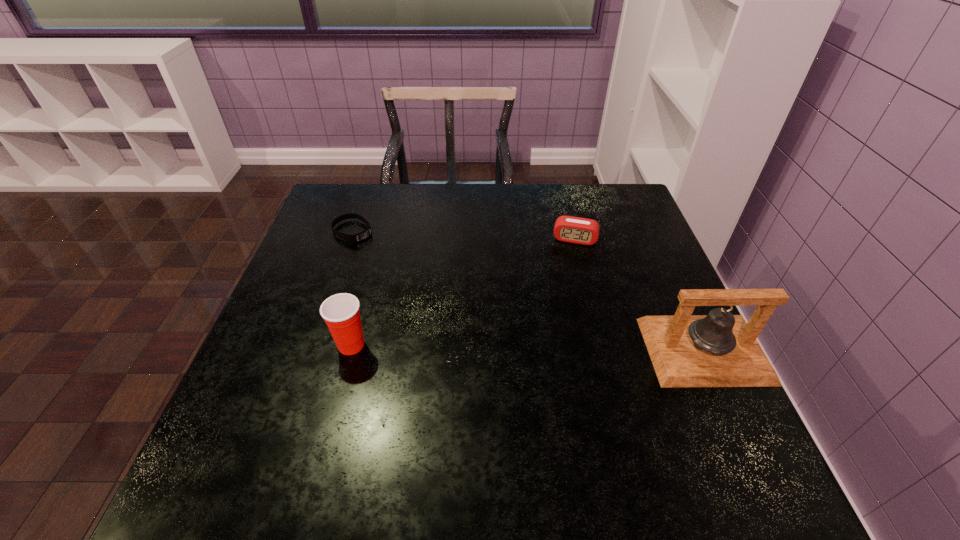
Find the location of a particular element. Image resolution: width=960 pixels, height=540 pixels. free point at the far edge is located at coordinates (425, 186).

Where is `free space at the near edge of the desktop`? The image size is (960, 540). free space at the near edge of the desktop is located at coordinates (635, 409).

You are a GUI agent. You are given a task and a screenshot of the screen. Output one action in this format:
    pyautogui.click(x=<x>, y=<y>)
    Task: Click on the free space at the left edge of the desktop
    
    Given the screenshot: What is the action you would take?
    pos(270,371)

In the image, there is a desktop. Identify the location of vacant area at the right edge. Image resolution: width=960 pixels, height=540 pixels. (641, 258).

Identify the location of vacant space at the far left corner of the desktop. (345, 187).

Find the location of `blank space at the near left corner of the desktop`. blank space at the near left corner of the desktop is located at coordinates (277, 399).

Identify the location of free space between the tallest object and the shortest object. (528, 291).

Where is `empty space that is in between the third object from left to right and the third shortest object`? Image resolution: width=960 pixels, height=540 pixels. empty space that is in between the third object from left to right and the third shortest object is located at coordinates (463, 292).

The image size is (960, 540). Identify the location of unoccupied position between the alarm clock and the third shortest object. (463, 292).

Find the location of a particular element. This screenshot has width=960, height=540. empty space between the bell and the third shortest object is located at coordinates (528, 348).